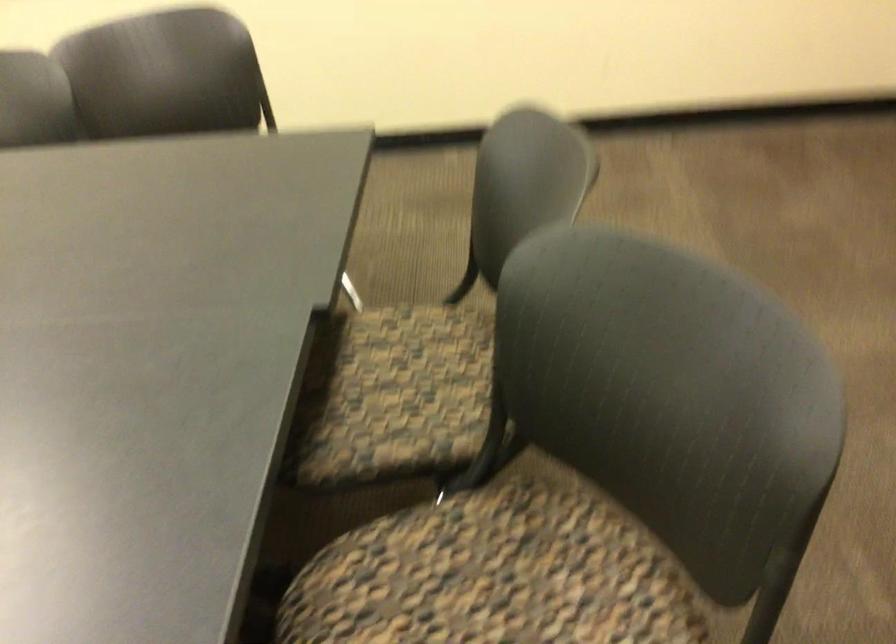
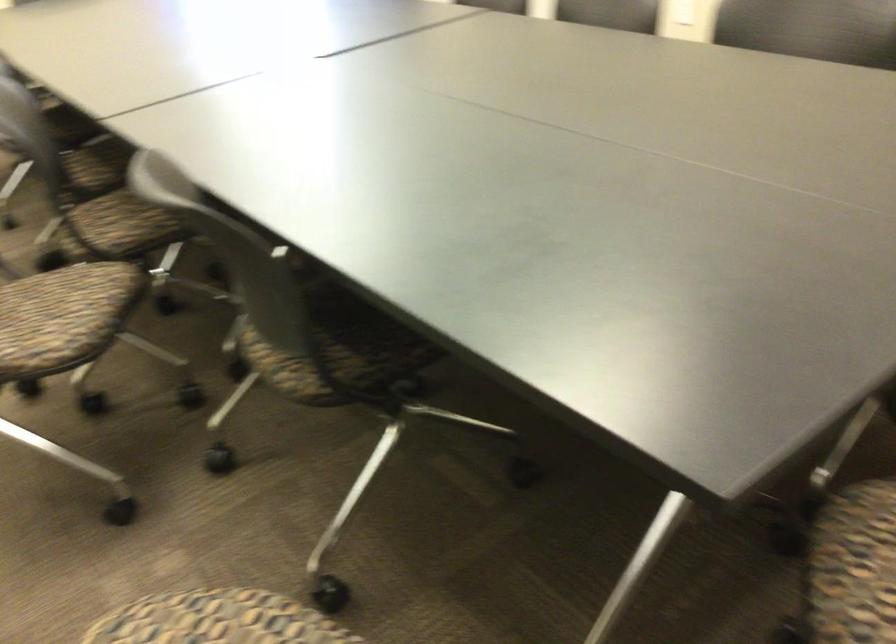
Question: The camera is either moving clockwise (left) or counter-clockwise (right) around the object. The first image is from the beginning of the video and the second image is from the end. Is the camera moving left or right when shooting the video?

Choices:
 (A) Left
 (B) Right

Answer: (B)